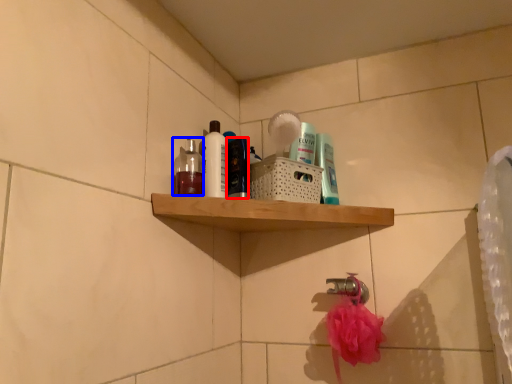
Question: Which object appears closest to the camera in this image, toiletry (highlighted by a red box) or mouthwash (highlighted by a blue box)?

Choices:
 (A) toiletry
 (B) mouthwash

Answer: (B)